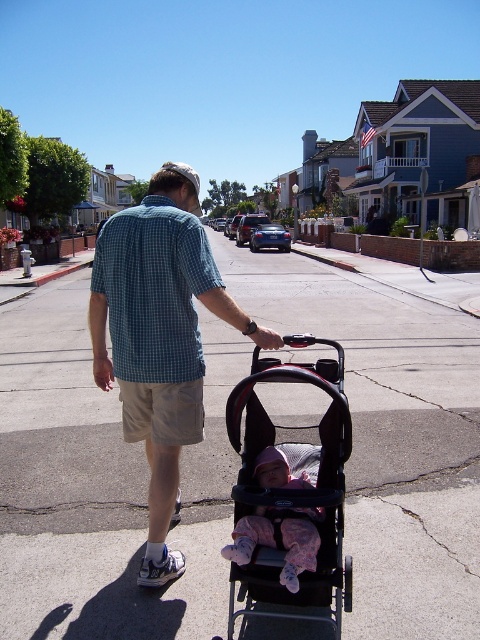
Between black textured baby carriage at center and pink fleece baby at center, which one is positioned lower?

pink fleece baby at center

Is black textured baby carriage at center positioned behind pink fleece baby at center?

Yes, black textured baby carriage at center is behind pink fleece baby at center.

Find the location of `black textured baby carriage at center`. black textured baby carriage at center is located at coordinates (294, 490).

This screenshot has height=640, width=480. What are the coordinates of `blue checkered shirt at center` in the screenshot? It's located at (159, 337).

Is gray asphalt pavement at center below blue checkered shirt at back?

No, gray asphalt pavement at center is not below blue checkered shirt at back.

From the picture: Does gray asphalt pavement at center have a greater width compared to blue checkered shirt at back?

Correct, the width of gray asphalt pavement at center exceeds that of blue checkered shirt at back.

Between point (67, 444) and point (117, 314), which one is positioned in front?

Point (117, 314) is in front.

Locate an element on the screen. gray asphalt pavement at center is located at coordinates (100, 484).